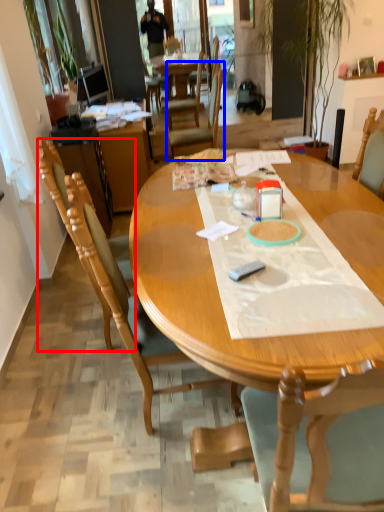
Question: Which object is closer to the camera taking this photo, chair (highlighted by a red box) or chair (highlighted by a blue box)?

Choices:
 (A) chair
 (B) chair

Answer: (A)